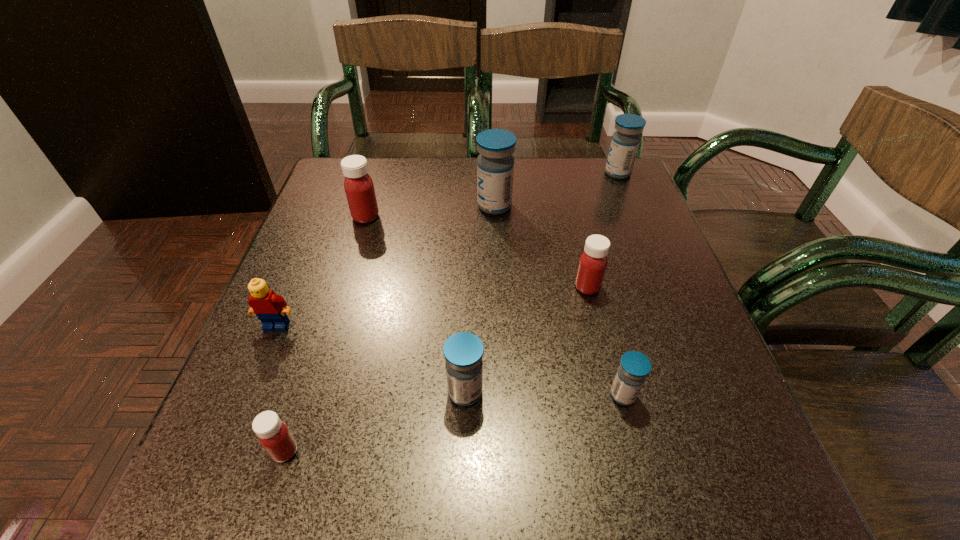
Where is `object identified as the closest to the farthest blue medicine`? This screenshot has width=960, height=540. object identified as the closest to the farthest blue medicine is located at coordinates (495, 165).

I want to click on object identified as the seventh closest to the rightmost object, so 275,437.

I want to click on medicine that is the third closest to the third biggest blue medicine, so click(x=593, y=262).

Identify which medicine is the second nearest to the second smallest blue medicine. Please provide its 2D coordinates. Your answer should be formatted as a tuple, i.e. [(x, y)], where the tuple contains the x and y coordinates of a point satisfying the conditions above.

[(275, 437)]

Locate which blue medicine ranks third in proximity to the biggest blue medicine. Please provide its 2D coordinates. Your answer should be formatted as a tuple, i.e. [(x, y)], where the tuple contains the x and y coordinates of a point satisfying the conditions above.

[(634, 367)]

Identify the location of blue medicine object that ranks as the second closest to the smallest red medicine. The image size is (960, 540). (634, 367).

The image size is (960, 540). I want to click on red medicine that is the closest to the smallest red medicine, so click(359, 188).

At what (x,y) coordinates should I click in order to perform the action: click on red medicine identified as the third closest to the fourth nearest object. Please return your answer as a coordinate pair (x, y). This screenshot has height=540, width=960. Looking at the image, I should click on (593, 262).

This screenshot has height=540, width=960. What are the coordinates of `vacant space that satisfies the following two spatial constraints: 1. on the back side of the rightmost object; 2. on the right side of the farthest red medicine` in the screenshot? It's located at (379, 173).

Identify the location of free space that satisfies the following two spatial constraints: 1. on the back side of the fourth farthest medicine; 2. on the right side of the rightmost blue medicine. The height and width of the screenshot is (540, 960). (561, 173).